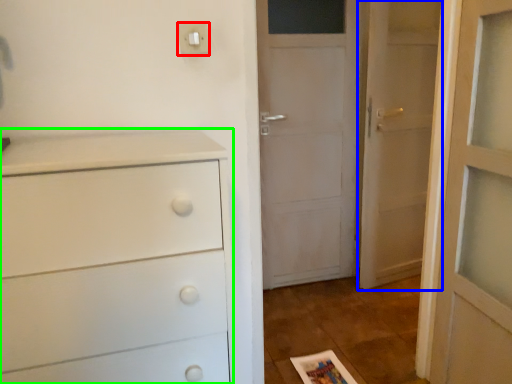
Question: Which object is positioned closest to light switch (highlighted by a red box)? Select from door (highlighted by a blue box) and chest of drawers (highlighted by a green box).

Choices:
 (A) door
 (B) chest of drawers

Answer: (B)